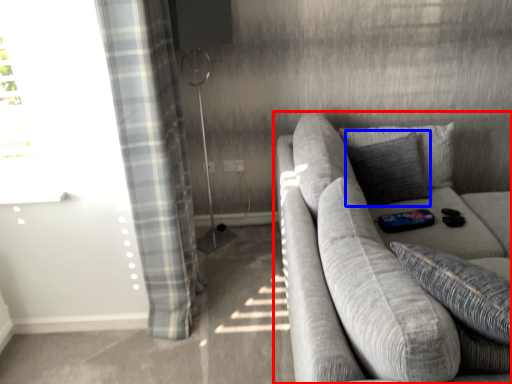
Question: Among these objects, which one is nearest to the camera, studio couch (highlighted by a red box) or pillow (highlighted by a blue box)?

Choices:
 (A) studio couch
 (B) pillow

Answer: (A)